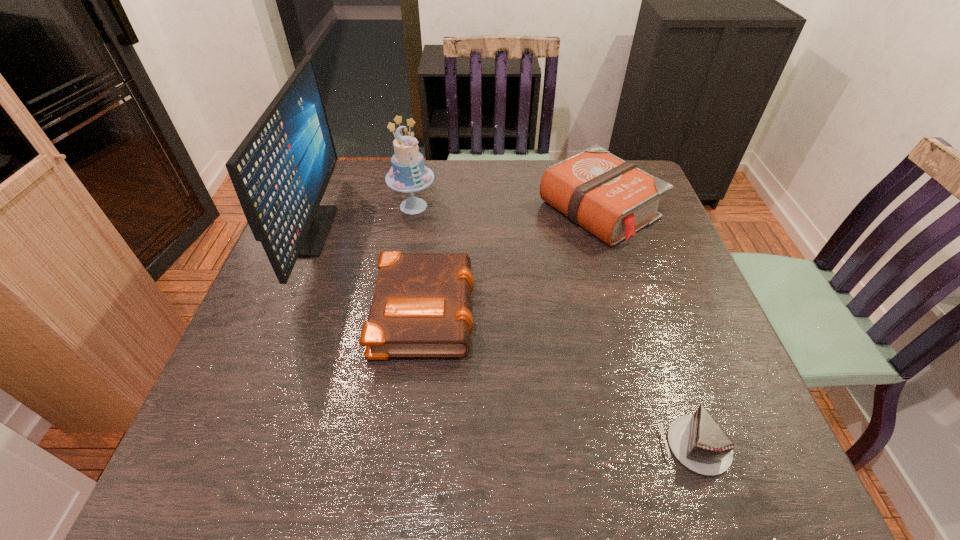
Where is `computer monitor`? This screenshot has width=960, height=540. computer monitor is located at coordinates (280, 171).

Locate an element on the screen. This screenshot has height=540, width=960. the tallest object is located at coordinates [x=280, y=171].

You are a GUI agent. You are given a task and a screenshot of the screen. Output one action in this format:
    pyautogui.click(x=<x>, y=<y>)
    Task: Click on the cake
    Image resolution: width=960 pixels, height=540 pixels.
    Given the screenshot: What is the action you would take?
    pyautogui.click(x=408, y=174)

Find the location of a particular element. the right Bible is located at coordinates (611, 198).

At what (x,y) coordinates should I click in order to perform the action: click on the third shortest object. Please return your answer as a coordinate pair (x, y). The image size is (960, 540). Looking at the image, I should click on (611, 198).

Where is `the fourth tallest object`? This screenshot has width=960, height=540. the fourth tallest object is located at coordinates (420, 308).

Find the location of a particular element. This screenshot has width=960, height=540. the left Bible is located at coordinates (420, 308).

The width and height of the screenshot is (960, 540). I want to click on the shortest object, so click(x=697, y=441).

In order to click on the nearest object in this screenshot , I will do `click(697, 441)`.

Find the location of a particular element. Image resolution: width=960 pixels, height=540 pixels. blank space located on the screen side of the computer monitor is located at coordinates (447, 231).